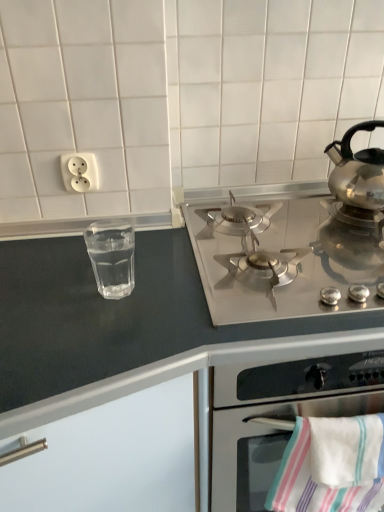
Question: Does polished stainless steel kettle at right lie behind transparent glass at left?

Choices:
 (A) yes
 (B) no

Answer: (A)

Question: Are polished stainless steel kettle at right and transparent glass at left beside each other?

Choices:
 (A) no
 (B) yes

Answer: (A)

Question: Is polished stainless steel kettle at right outside transparent glass at left?

Choices:
 (A) yes
 (B) no

Answer: (A)

Question: From a real-world perspective, is polished stainless steel kettle at right located higher than transparent glass at left?

Choices:
 (A) no
 (B) yes

Answer: (B)

Question: Is polished stainless steel kettle at right oriented towards transparent glass at left?

Choices:
 (A) yes
 (B) no

Answer: (B)

Question: Would you say transparent glass at left is part of polished stainless steel kettle at right's contents?

Choices:
 (A) no
 (B) yes

Answer: (A)

Question: From the image's perspective, is stainless steel gas stove at upper center over polished stainless steel kettle at right?

Choices:
 (A) yes
 (B) no

Answer: (B)

Question: Is stainless steel gas stove at upper center in front of polished stainless steel kettle at right?

Choices:
 (A) yes
 (B) no

Answer: (A)

Question: Is stainless steel gas stove at upper center outside of polished stainless steel kettle at right?

Choices:
 (A) yes
 (B) no

Answer: (A)

Question: Can you confirm if stainless steel gas stove at upper center is smaller than polished stainless steel kettle at right?

Choices:
 (A) yes
 (B) no

Answer: (B)

Question: Considering the relative sizes of stainless steel gas stove at upper center and polished stainless steel kettle at right in the image provided, is stainless steel gas stove at upper center taller than polished stainless steel kettle at right?

Choices:
 (A) yes
 (B) no

Answer: (A)

Question: Is stainless steel gas stove at upper center at the right side of polished stainless steel kettle at right?

Choices:
 (A) no
 (B) yes

Answer: (A)

Question: Does satin silver gas stove at upper right turn towards polished stainless steel kettle at right?

Choices:
 (A) no
 (B) yes

Answer: (A)